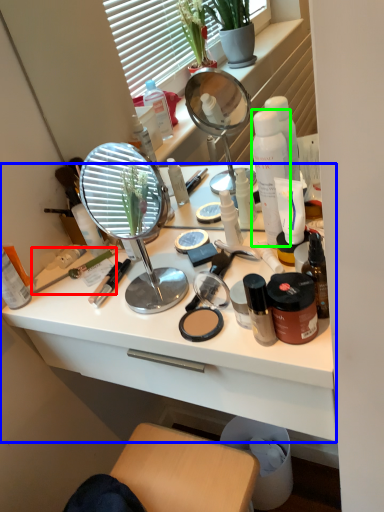
Question: Estimate the real-world distances between objects in this image. Which object is farther from brush (highlighted by a red box), desk (highlighted by a blue box) or product (highlighted by a green box)?

Choices:
 (A) desk
 (B) product

Answer: (B)